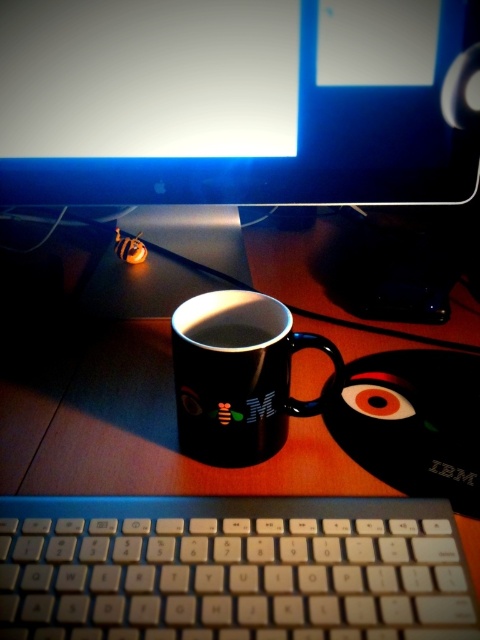
Can you confirm if black glossy monitor at upper center is wider than white plastic keyboard at lower center?

Correct, the width of black glossy monitor at upper center exceeds that of white plastic keyboard at lower center.

Does point (223, 136) lie in front of point (469, 593)?

No, it is behind (469, 593).

Which is in front, point (362, 179) or point (300, 568)?

Point (300, 568) is in front.

Locate an element on the screen. This screenshot has width=480, height=640. black glossy monitor at upper center is located at coordinates (232, 100).

Who is higher up, black glossy mouse pad at center or black glossy monitor at upper center?

black glossy monitor at upper center

Between black glossy mouse pad at center and black glossy monitor at upper center, which one has less height?

black glossy monitor at upper center is shorter.

What do you see at coordinates (189, 490) in the screenshot? I see `black glossy mouse pad at center` at bounding box center [189, 490].

At what (x,y) coordinates should I click in order to perform the action: click on black glossy mouse pad at center. Please return your answer as a coordinate pair (x, y). Looking at the image, I should click on (189, 490).

Can you confirm if black glossy mouse pad at center is taller than white plastic keyboard at lower center?

Yes, black glossy mouse pad at center is taller than white plastic keyboard at lower center.

Looking at this image, is black glossy mouse pad at center to the left of white plastic keyboard at lower center from the viewer's perspective?

Indeed, black glossy mouse pad at center is positioned on the left side of white plastic keyboard at lower center.

Image resolution: width=480 pixels, height=640 pixels. Identify the location of black glossy mouse pad at center. (189, 490).